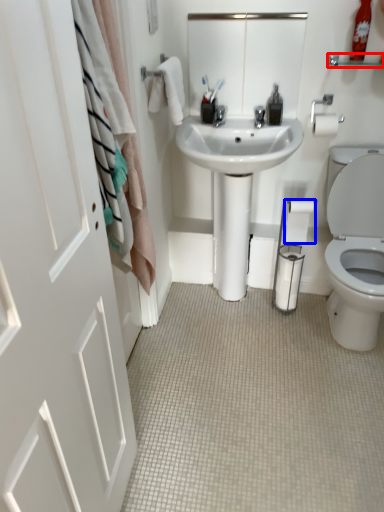
Question: Which object is closer to the camera taking this photo, balustrade (highlighted by a red box) or toilet paper (highlighted by a blue box)?

Choices:
 (A) balustrade
 (B) toilet paper

Answer: (A)